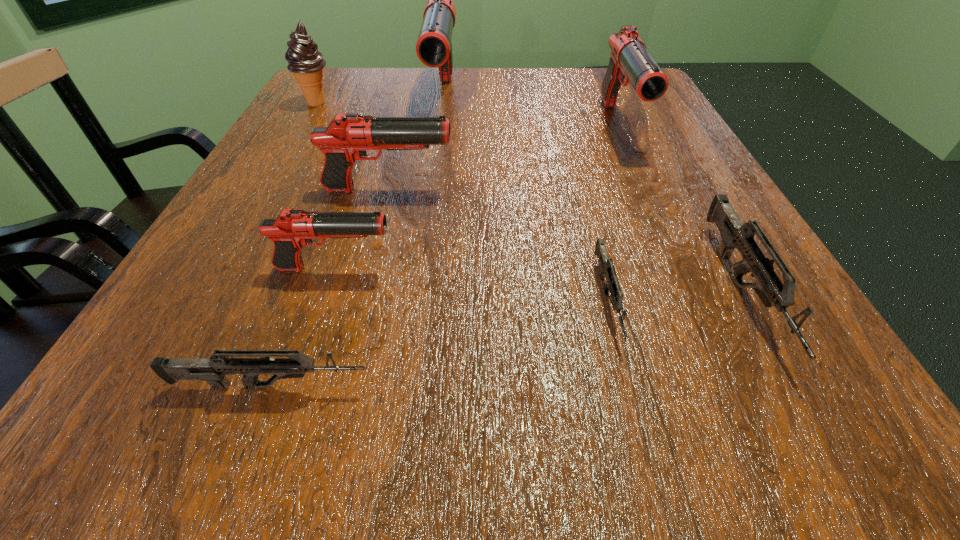
I want to click on grey gun identified as the closest to the leftmost grey gun, so click(x=607, y=269).

Where is `grey gun that stands as the closest to the rightmost black gun`? grey gun that stands as the closest to the rightmost black gun is located at coordinates (735, 234).

This screenshot has height=540, width=960. I want to click on blank space that satisfies the following two spatial constraints: 1. aimed along the barrel of the smallest grey gun; 2. aimed along the barrel of the leftmost grey gun, so click(x=630, y=386).

Find the location of a particular element. The height and width of the screenshot is (540, 960). free space that satisfies the following two spatial constraints: 1. at the aiming end of the biggest black gun; 2. at the aiming end of the fifth shortest object is located at coordinates (432, 190).

This screenshot has width=960, height=540. Find the location of `free region that satisfies the following two spatial constraints: 1. at the aiming end of the second gun from right to left; 2. aimed along the barrel of the seventh tallest object`. free region that satisfies the following two spatial constraints: 1. at the aiming end of the second gun from right to left; 2. aimed along the barrel of the seventh tallest object is located at coordinates (735, 386).

At what (x,y) coordinates should I click in order to perform the action: click on vacant position in the image that satisfies the following two spatial constraints: 1. at the aiming end of the tallest object; 2. at the aiming end of the fourth tallest object. Please return your answer as a coordinate pair (x, y). This screenshot has height=540, width=960. Looking at the image, I should click on (432, 190).